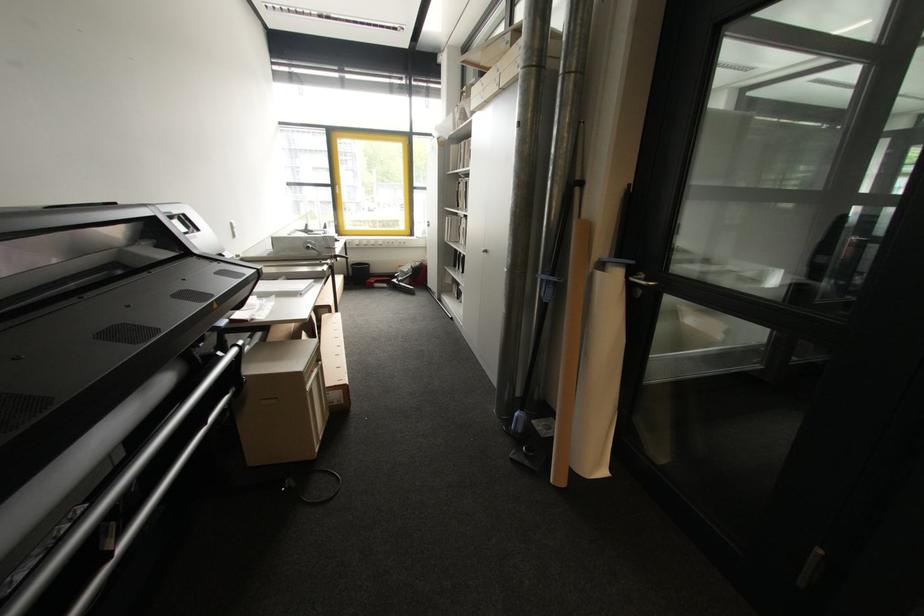
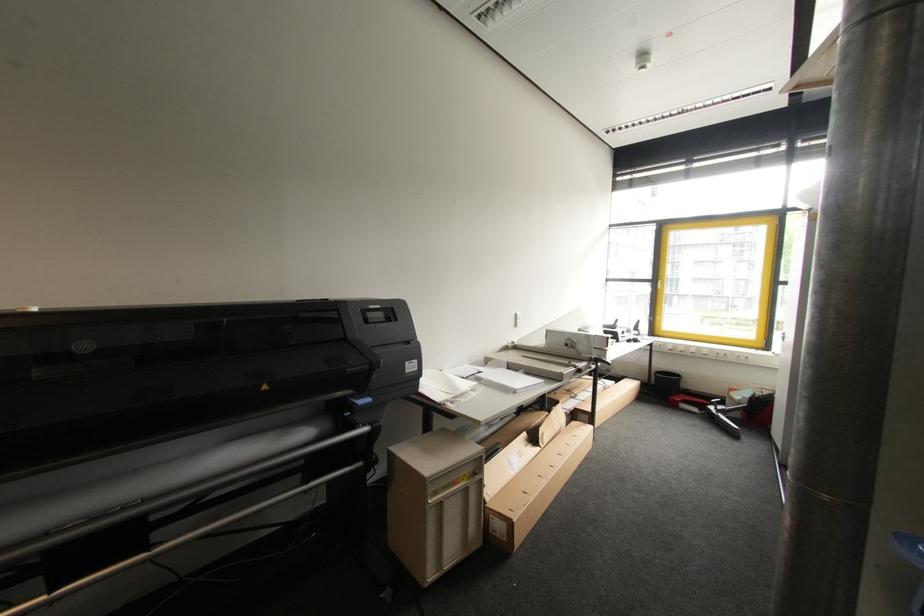
Question: The camera is either moving clockwise (left) or counter-clockwise (right) around the object. The first image is from the beginning of the video and the second image is from the end. Is the camera moving left or right when shooting the video?

Choices:
 (A) Left
 (B) Right

Answer: (B)